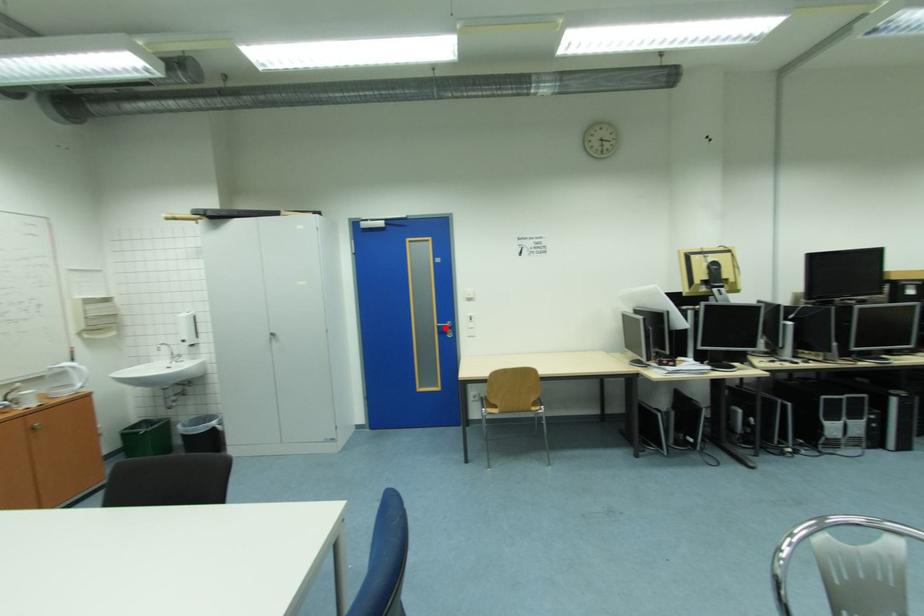
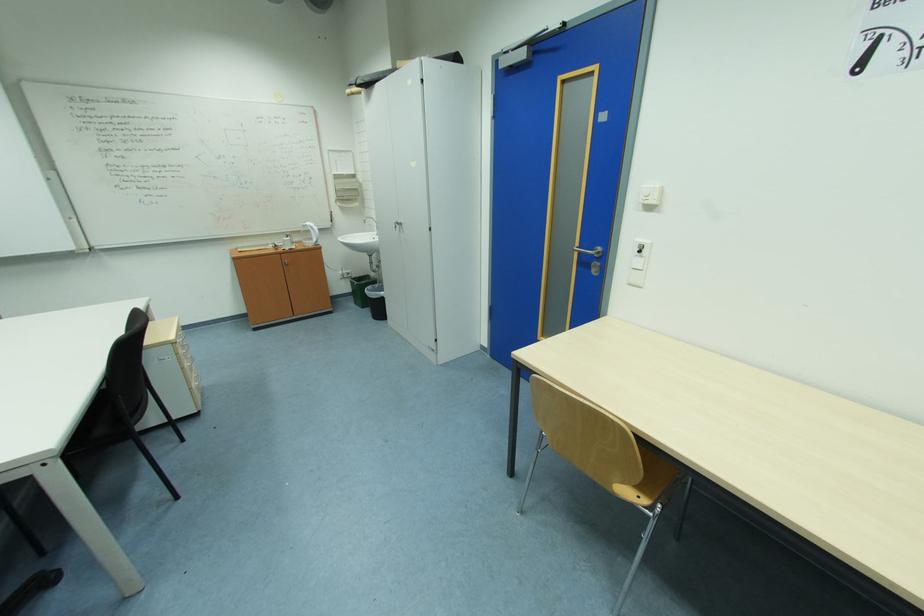
Locate, in the second image, the point that corresponds to the highlighted location in the first image.

(587, 253)